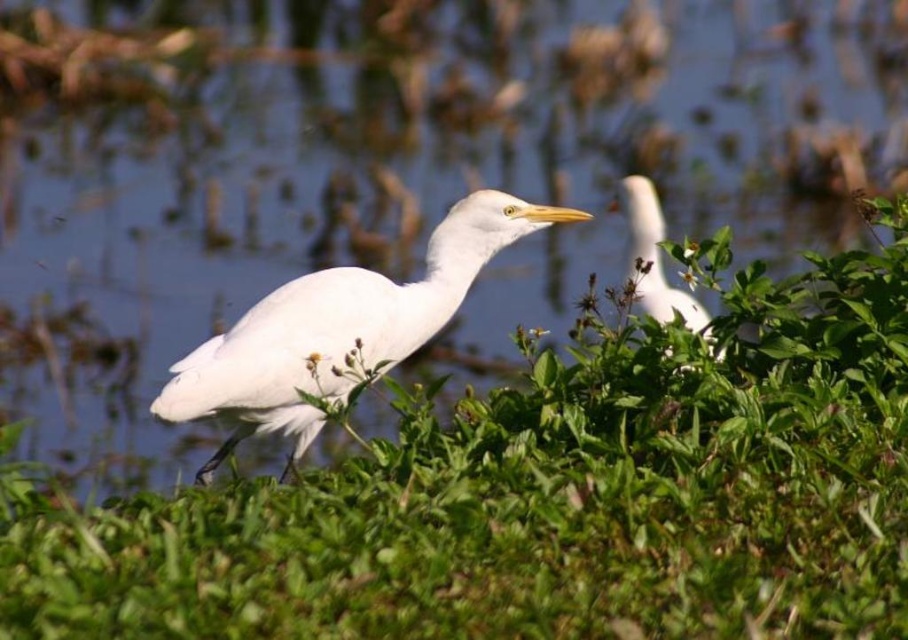
You are a photographer aiming to capture both the green leafy plant at center and the white smooth bird at upper right in your shot. Based on their positions, which object should you adjust your camera focus to first to ensure both are in frame?

The green leafy plant at center is to the left of the white smooth bird at upper right, so you should focus on the white smooth bird at upper right first to ensure both are in frame.

You are a photographer aiming to capture a clear image of the white matte bird at center without the green leafy plant at center obstructing it. Based on their positions, is this possible?

The green leafy plant at center is closer to the viewer than the white matte bird at center, so the plant would obstruct the view of the bird. Therefore, capturing a clear image of the white matte bird at center without the green leafy plant at center obstructing it is not possible.